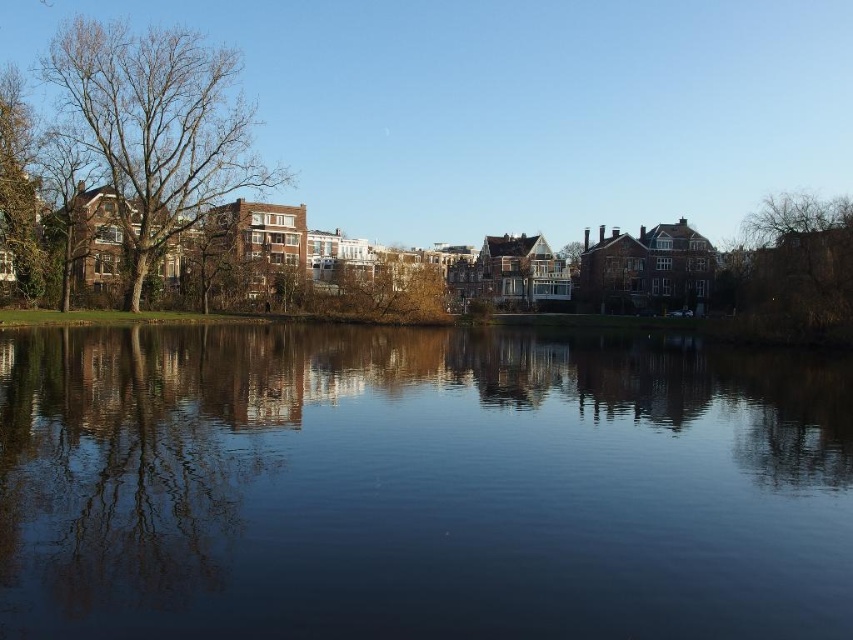
In the scene shown: Who is taller, dark reflective water at center or brown leafy tree at center?

dark reflective water at center

Can you confirm if dark reflective water at center is taller than brown leafy tree at center?

Yes, dark reflective water at center is taller than brown leafy tree at center.

Does point (343, 500) lie behind point (386, 272)?

No, (343, 500) is closer to viewer.

Locate an element on the screen. Image resolution: width=853 pixels, height=640 pixels. dark reflective water at center is located at coordinates click(418, 486).

Which is in front, point (645, 419) or point (143, 163)?

Point (645, 419) is more forward.

Between dark reflective water at center and bare branches at left, which one is positioned higher?

Positioned higher is bare branches at left.

Image resolution: width=853 pixels, height=640 pixels. What are the coordinates of `dark reflective water at center` in the screenshot? It's located at (418, 486).

Can you confirm if bare branches at left is wider than brown leafy tree at center?

Yes.

Does bare branches at left have a greater height compared to brown leafy tree at center?

Yes, bare branches at left is taller than brown leafy tree at center.

Where is `bare branches at left`? bare branches at left is located at coordinates (155, 125).